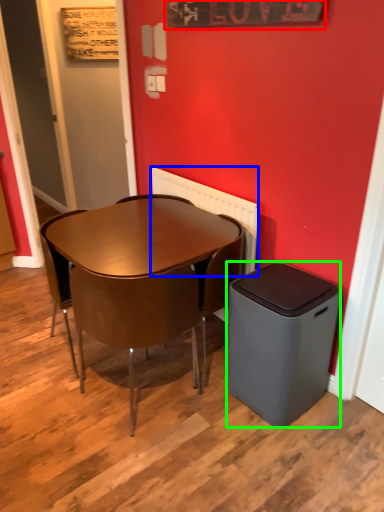
Question: Which is farther away from bulletin board (highlighted by a red box)? radiator (highlighted by a blue box) or trash bin/can (highlighted by a green box)?

Choices:
 (A) radiator
 (B) trash bin/can

Answer: (B)